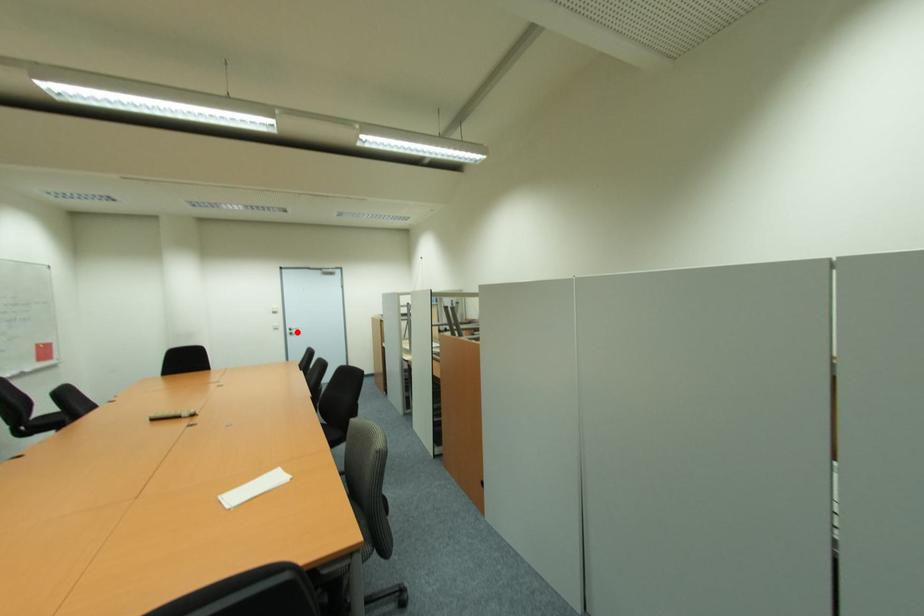
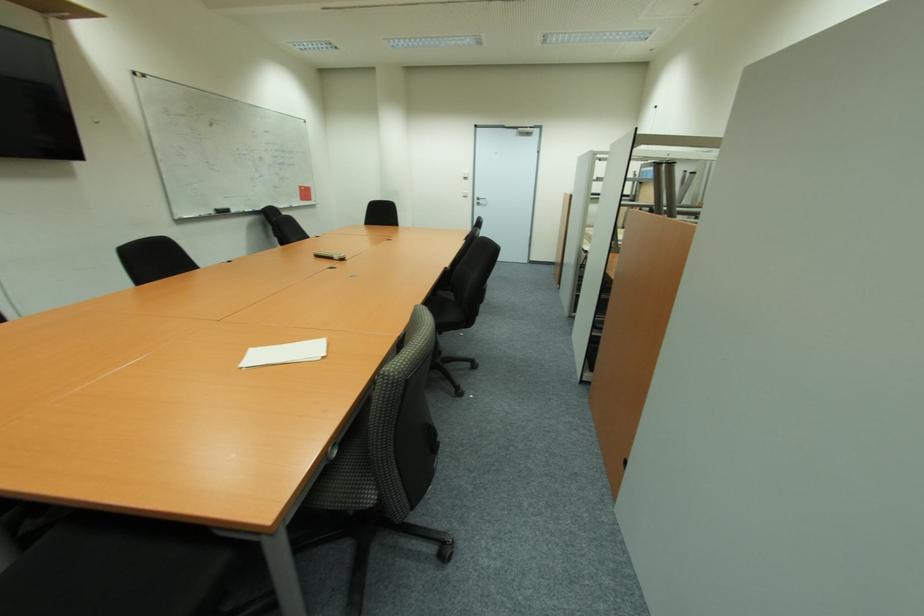
Question: I am providing you with two images of the same scene from different viewpoints. Given a red point in image1, look at the same physical point in image2. Is it:

Choices:
 (A) Closer to the viewpoint
 (B) Farther from the viewpoint

Answer: (A)